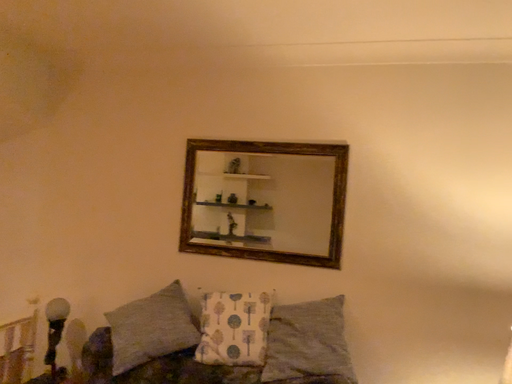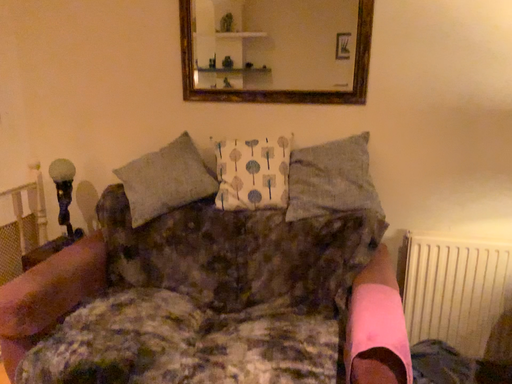
Question: Which way did the camera rotate in the video?

Choices:
 (A) rotated downward
 (B) rotated upward

Answer: (A)